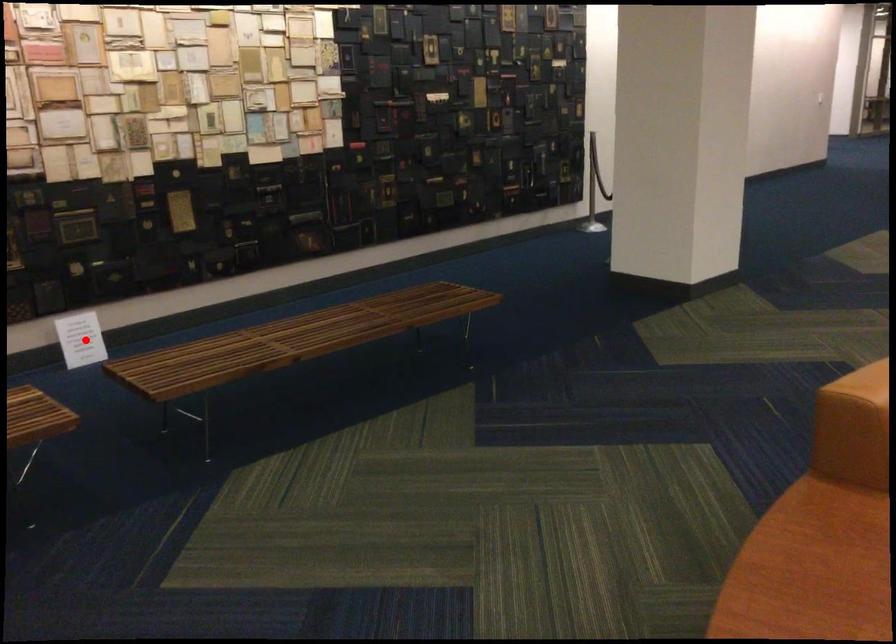
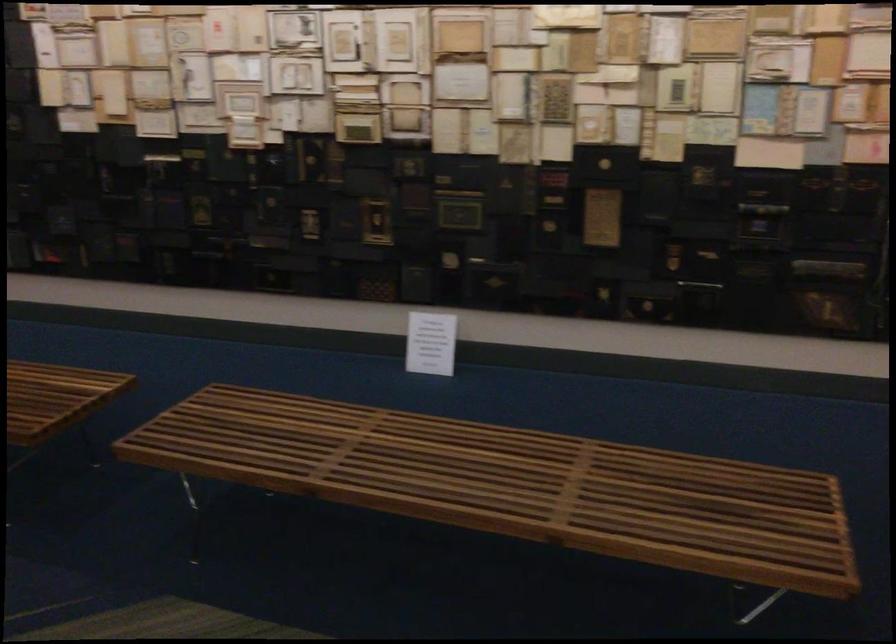
Where in the second image is the point corresponding to the highlighted location from the first image?

(431, 343)